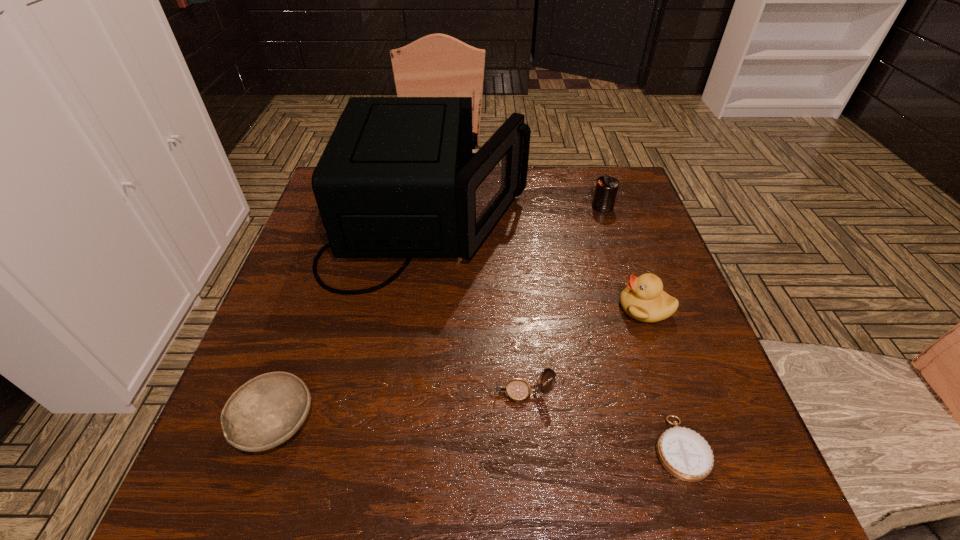
The image size is (960, 540). In order to click on vacant space located on the beak of the duckling in this screenshot , I will do `click(457, 308)`.

In order to click on free space located on the beak of the duckling in this screenshot , I will do `click(470, 308)`.

I want to click on vacant position located 0.120m on the beak of the duckling, so click(565, 308).

Identify the location of free space located on the face of the taller compass. The width and height of the screenshot is (960, 540). (285, 393).

Where is `vacant position located on the face of the taller compass`? vacant position located on the face of the taller compass is located at coordinates (x=396, y=393).

Find the location of a particular element. free space located 0.200m on the face of the taller compass is located at coordinates (386, 393).

Identify the location of vacant region located on the back of the bowl. (296, 365).

The height and width of the screenshot is (540, 960). I want to click on free region located 0.350m on the back of the shorter compass, so click(625, 279).

I want to click on microwave oven that is at the far edge, so coord(398,178).

Where is `can that is positioned at the far edge`? The width and height of the screenshot is (960, 540). can that is positioned at the far edge is located at coordinates (606, 189).